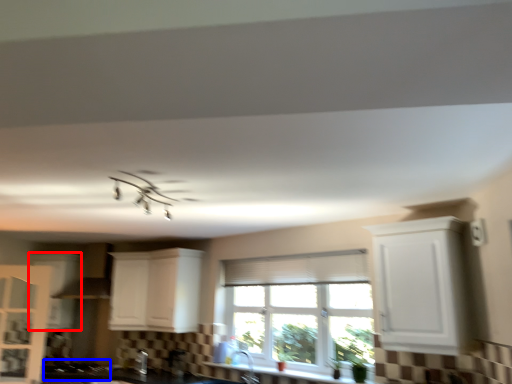
Question: Which object appears closest to the camera in this image, cabinetry (highlighted by a red box) or gas stove (highlighted by a blue box)?

Choices:
 (A) cabinetry
 (B) gas stove

Answer: (B)